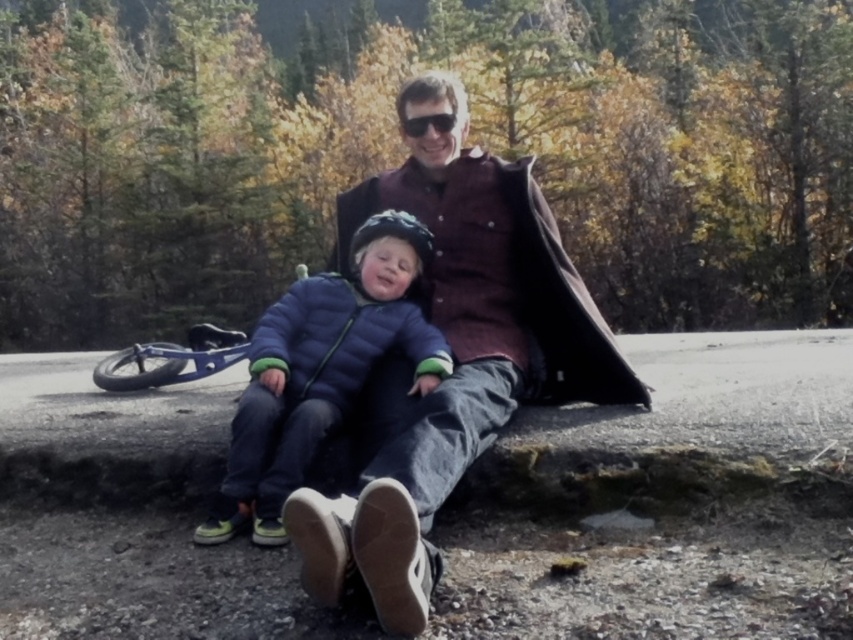
Question: Which object is positioned farthest from the blue puffy jacket at center?

Choices:
 (A) maroon button-up shirt at center
 (B) shiny black sunglasses at center

Answer: (B)

Question: Does blue puffy jacket at center appear on the right side of shiny black sunglasses at center?

Choices:
 (A) no
 (B) yes

Answer: (A)

Question: Is maroon button-up shirt at center smaller than blue puffy jacket at center?

Choices:
 (A) yes
 (B) no

Answer: (B)

Question: Which of the following is the farthest from the observer?

Choices:
 (A) shiny black sunglasses at center
 (B) blue puffy jacket at center
 (C) maroon button-up shirt at center

Answer: (A)

Question: Can you confirm if maroon button-up shirt at center is positioned below shiny black sunglasses at center?

Choices:
 (A) no
 (B) yes

Answer: (B)

Question: Which of the following is the closest to the observer?

Choices:
 (A) (308, 560)
 (B) (434, 120)

Answer: (A)